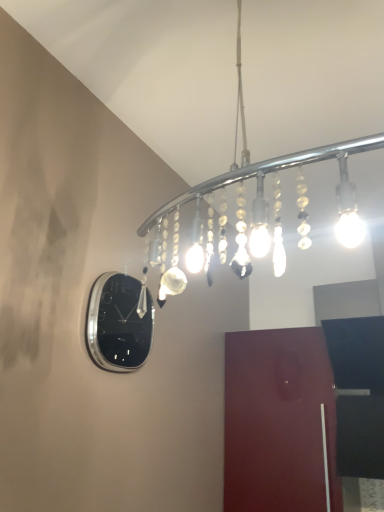
Question: Should I look upward or downward to see glossy wood door at lower right?

Choices:
 (A) up
 (B) down

Answer: (B)

Question: Can you confirm if glossy wood door at lower right is wider than polished silver clock at upper left?

Choices:
 (A) no
 (B) yes

Answer: (B)

Question: Considering the relative positions of glossy wood door at lower right and polished silver clock at upper left in the image provided, is glossy wood door at lower right in front of polished silver clock at upper left?

Choices:
 (A) no
 (B) yes

Answer: (A)

Question: Is glossy wood door at lower right behind polished silver clock at upper left?

Choices:
 (A) no
 (B) yes

Answer: (B)

Question: Does glossy wood door at lower right appear on the left side of polished silver clock at upper left?

Choices:
 (A) no
 (B) yes

Answer: (A)

Question: Is glossy wood door at lower right taller than polished silver clock at upper left?

Choices:
 (A) yes
 (B) no

Answer: (A)

Question: Is polished silver clock at upper left completely or partially inside glossy wood door at lower right?

Choices:
 (A) yes
 (B) no

Answer: (B)

Question: Considering the relative sizes of polished silver clock at upper left and glossy wood door at lower right in the image provided, is polished silver clock at upper left thinner than glossy wood door at lower right?

Choices:
 (A) yes
 (B) no

Answer: (A)

Question: From the image's perspective, is polished silver clock at upper left beneath glossy wood door at lower right?

Choices:
 (A) yes
 (B) no

Answer: (B)

Question: Are polished silver clock at upper left and glossy wood door at lower right located far from each other?

Choices:
 (A) no
 (B) yes

Answer: (A)

Question: Is the depth of polished silver clock at upper left greater than that of glossy wood door at lower right?

Choices:
 (A) no
 (B) yes

Answer: (A)

Question: Would you say polished silver clock at upper left contains glossy wood door at lower right?

Choices:
 (A) no
 (B) yes

Answer: (A)

Question: From a real-world perspective, is polished silver clock at upper left located higher than glossy wood door at lower right?

Choices:
 (A) yes
 (B) no

Answer: (A)

Question: Considering the relative sizes of glossy wood door at lower right and clear glass chandelier at upper center in the image provided, is glossy wood door at lower right thinner than clear glass chandelier at upper center?

Choices:
 (A) yes
 (B) no

Answer: (A)